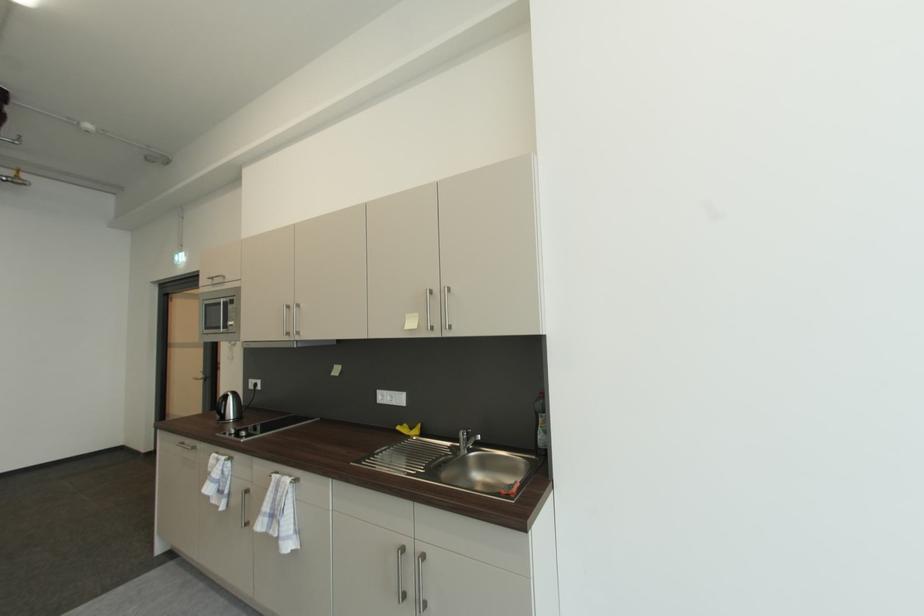
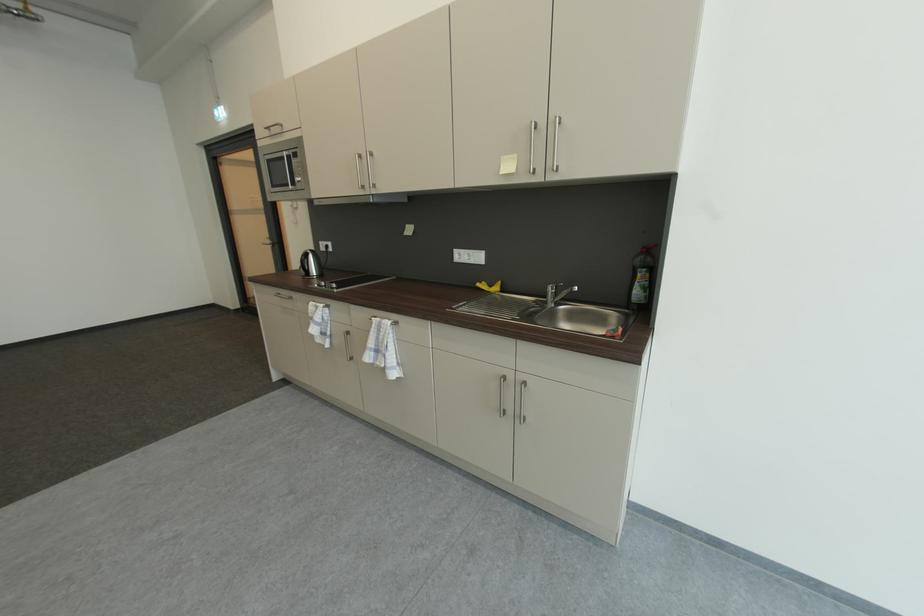
Find the pixel in the second image that matches point 227,304 in the first image.

(290, 158)